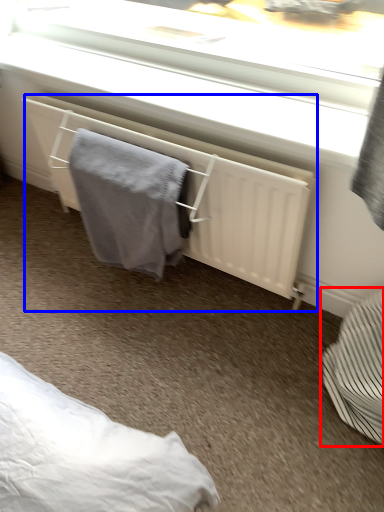
Question: Which object is further to the camera taking this photo, furniture (highlighted by a red box) or radiator (highlighted by a blue box)?

Choices:
 (A) furniture
 (B) radiator

Answer: (B)